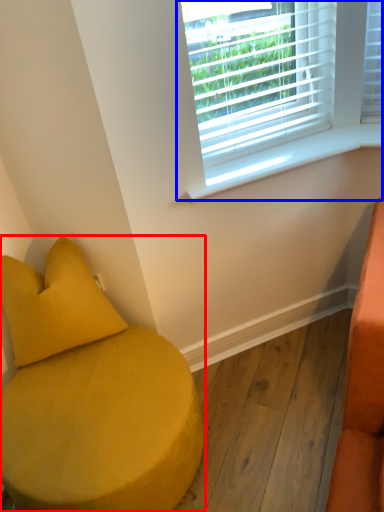
Question: Among these objects, which one is farthest to the camera, furniture (highlighted by a red box) or window (highlighted by a blue box)?

Choices:
 (A) furniture
 (B) window

Answer: (B)